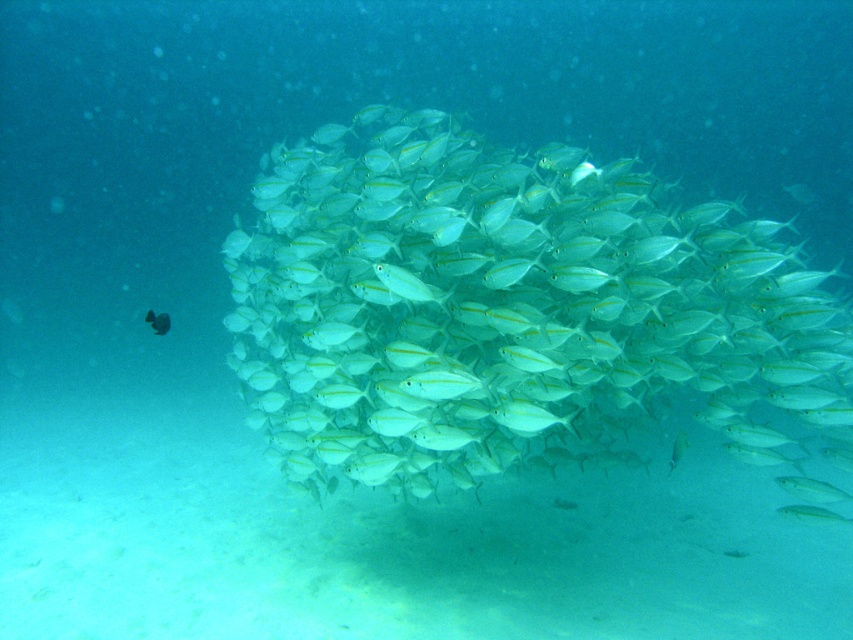
You are a marine biologist observing the underwater scene. You notice two types of fish at the center of the image. Which one is bigger between the translucent white fish at center and the shiny silver fish at center?

The translucent white fish at center is larger in size than the shiny silver fish at center.

You are a marine biologist observing an underwater scene with a translucent white fish at center and a shiny silver fish at center. Which fish is positioned closer to you?

The translucent white fish at center is closer to the viewer than the shiny silver fish at center.